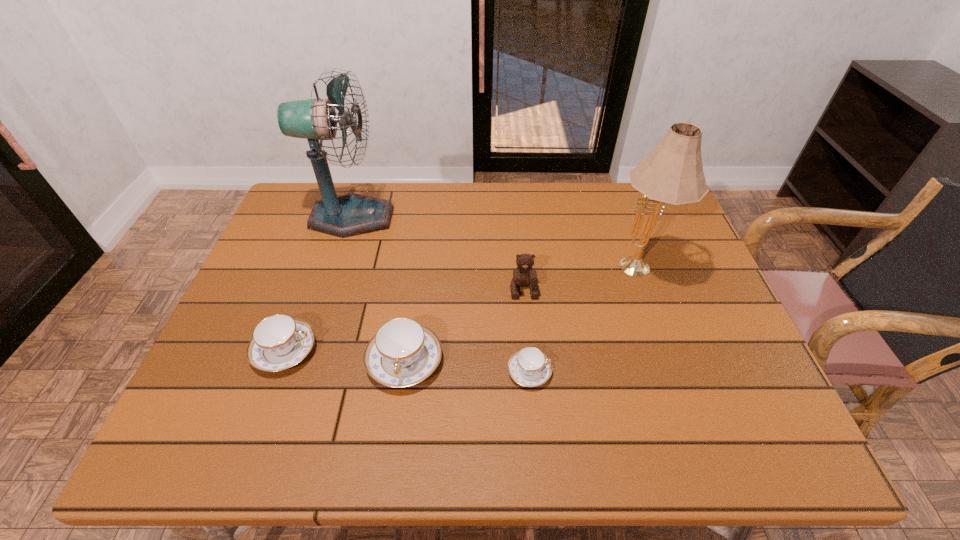
Locate an element on the screen. The image size is (960, 540). vacant area between the second teacup from left to right and the rightmost object is located at coordinates (521, 316).

At what (x,y) coordinates should I click in order to perform the action: click on free space between the lampshade and the shortest object. Please return your answer as a coordinate pair (x, y). Looking at the image, I should click on (583, 321).

Identify the location of empty location between the rightmost object and the teddy bear. (580, 280).

Locate an element on the screen. Image resolution: width=960 pixels, height=540 pixels. vacant point located between the farthest object and the third object from left to right is located at coordinates (378, 289).

Image resolution: width=960 pixels, height=540 pixels. Identify the location of object that ranks as the second closest to the teddy bear. (402, 353).

Select which object appears as the fifth closest to the fan. Please provide its 2D coordinates. Your answer should be formatted as a tuple, i.e. [(x, y)], where the tuple contains the x and y coordinates of a point satisfying the conditions above.

[(673, 173)]

Choose which teacup is the third nearest neighbor to the farthest object. Please provide its 2D coordinates. Your answer should be formatted as a tuple, i.e. [(x, y)], where the tuple contains the x and y coordinates of a point satisfying the conditions above.

[(529, 367)]

The image size is (960, 540). I want to click on teacup that is the closest to the shortest object, so click(x=402, y=353).

Find the location of `free space that satisfies the following two spatial constraints: 1. in front of the rightmost object where the wind blows; 2. on the right side of the farthest object`. free space that satisfies the following two spatial constraints: 1. in front of the rightmost object where the wind blows; 2. on the right side of the farthest object is located at coordinates (335, 271).

Identify the location of vacant area in the image that satisfies the following two spatial constraints: 1. on the face of the third tallest object; 2. on the side with the handle of the leftmost teacup. 529,350.